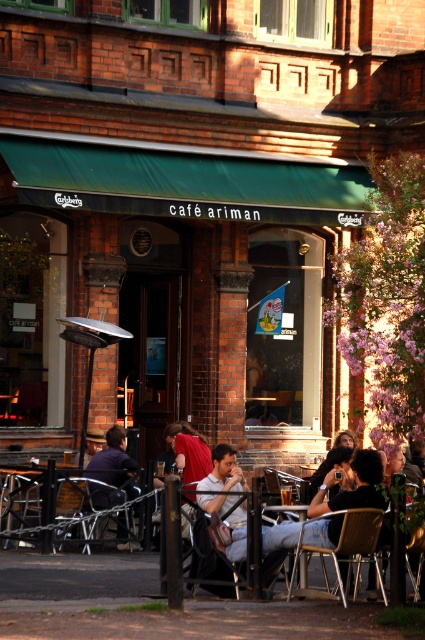
Question: In this image, where is metallic silver table at center located relative to metallic silver chair at center?

Choices:
 (A) right
 (B) left

Answer: (B)

Question: Which point is farther to the camera?

Choices:
 (A) metallic silver table at center
 (B) dark purple shirt at center
 (C) metallic silver chair at center

Answer: (B)

Question: From the image, what is the correct spatial relationship of matte black jacket at center in relation to metallic silver chair at center?

Choices:
 (A) above
 (B) below

Answer: (A)

Question: Does matte black jacket at center appear on the right side of dark purple shirt at center?

Choices:
 (A) no
 (B) yes

Answer: (B)

Question: Which of these objects is positioned farthest from the matte black jacket at center?

Choices:
 (A) dark purple shirt at center
 (B) metallic silver chair at center
 (C) metallic gold chair at lower center

Answer: (A)

Question: Which of the following is the closest to the observer?

Choices:
 (A) matte black jacket at center
 (B) metallic silver table at center
 (C) dark purple shirt at center
 (D) metallic silver chair at center

Answer: (A)